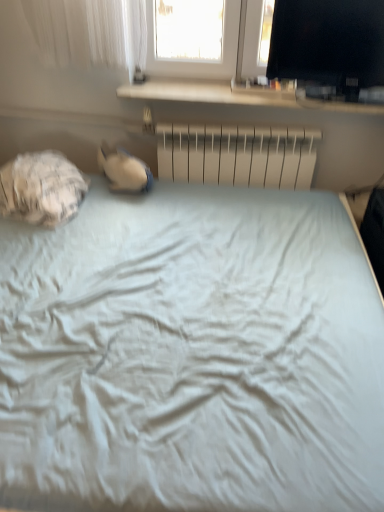
Question: Is black glossy monitor at upper right positioned with its back to white textured sleeping bag at left?

Choices:
 (A) no
 (B) yes

Answer: (A)

Question: From the image's perspective, is black glossy monitor at upper right over white textured sleeping bag at left?

Choices:
 (A) no
 (B) yes

Answer: (B)

Question: Can you confirm if black glossy monitor at upper right is wider than white textured sleeping bag at left?

Choices:
 (A) yes
 (B) no

Answer: (B)

Question: Is black glossy monitor at upper right thinner than white textured sleeping bag at left?

Choices:
 (A) yes
 (B) no

Answer: (A)

Question: Is black glossy monitor at upper right at the left side of white textured sleeping bag at left?

Choices:
 (A) yes
 (B) no

Answer: (B)

Question: Considering the positions of black glossy monitor at upper right and white textured sleeping bag at left in the image, is black glossy monitor at upper right taller or shorter than white textured sleeping bag at left?

Choices:
 (A) tall
 (B) short

Answer: (A)

Question: Based on their sizes in the image, would you say black glossy monitor at upper right is bigger or smaller than white textured sleeping bag at left?

Choices:
 (A) small
 (B) big

Answer: (A)

Question: Looking at their shapes, would you say black glossy monitor at upper right is wider or thinner than white textured sleeping bag at left?

Choices:
 (A) thin
 (B) wide

Answer: (A)

Question: From the image's perspective, is black glossy monitor at upper right located above or below white textured sleeping bag at left?

Choices:
 (A) above
 (B) below

Answer: (A)

Question: From a real-world perspective, relative to black glossy monitor at upper right, is metallic silver radiator at center vertically above or below?

Choices:
 (A) above
 (B) below

Answer: (B)

Question: Is metallic silver radiator at center to the left or to the right of black glossy monitor at upper right in the image?

Choices:
 (A) right
 (B) left

Answer: (B)

Question: Is point (309, 151) positioned closer to the camera than point (347, 80)?

Choices:
 (A) closer
 (B) farther

Answer: (B)

Question: Considering the positions of metallic silver radiator at center and black glossy monitor at upper right in the image, is metallic silver radiator at center taller or shorter than black glossy monitor at upper right?

Choices:
 (A) tall
 (B) short

Answer: (B)

Question: Is white textured sleeping bag at left wider or thinner than black glossy monitor at upper right?

Choices:
 (A) thin
 (B) wide

Answer: (B)

Question: From the image's perspective, is white textured sleeping bag at left positioned above or below black glossy monitor at upper right?

Choices:
 (A) above
 (B) below

Answer: (B)